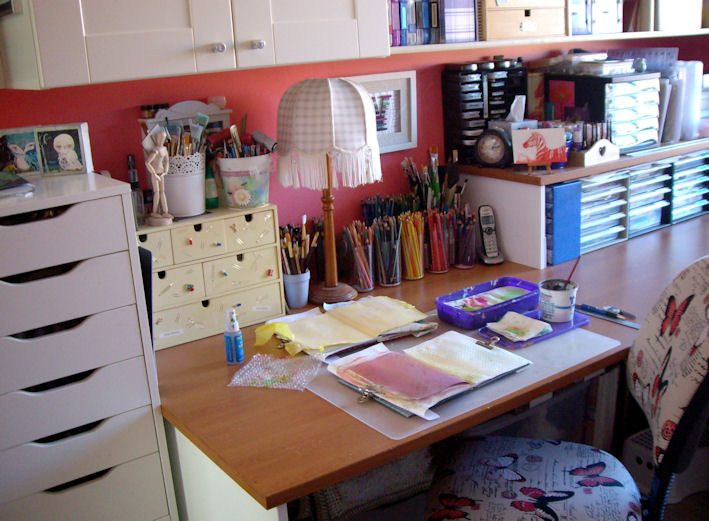
The image size is (709, 521). In order to click on chair in this screenshot , I will do [x=547, y=478].